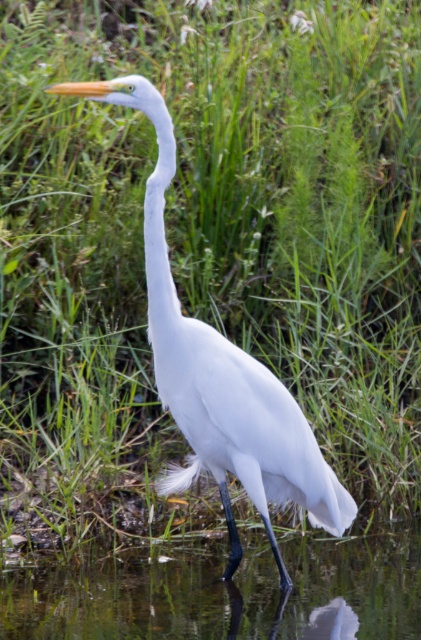
Question: Is white feathered bird at center to the left of white matte neck at center from the viewer's perspective?

Choices:
 (A) no
 (B) yes

Answer: (A)

Question: Is white feathered bird at center to the right of white matte neck at center from the viewer's perspective?

Choices:
 (A) yes
 (B) no

Answer: (A)

Question: Is clear water at lower center to the left of white feathered bird at center from the viewer's perspective?

Choices:
 (A) yes
 (B) no

Answer: (B)

Question: Among these objects, which one is nearest to the camera?

Choices:
 (A) white matte neck at center
 (B) clear water at lower center
 (C) white feathered bird at center

Answer: (C)

Question: Which point is closer to the camera taking this photo?

Choices:
 (A) (157, 141)
 (B) (250, 540)
 (C) (301, 492)

Answer: (C)

Question: Estimate the real-world distances between objects in this image. Which object is closer to the clear water at lower center?

Choices:
 (A) white matte neck at center
 (B) white feathered bird at center

Answer: (B)